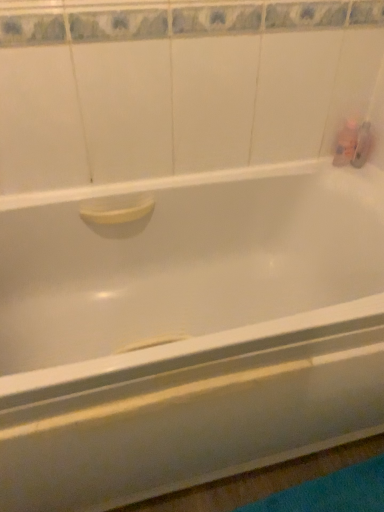
Question: From a real-world perspective, is translucent plastic bottle at upper right, the 1th toiletry viewed from the left, physically located above or below translucent plastic soap at upper right, which ranks as the second toiletry in left-to-right order?

Choices:
 (A) above
 (B) below

Answer: (A)

Question: Would you say translucent plastic bottle at upper right, which is the second toiletry in right-to-left order, is to the left or to the right of translucent plastic soap at upper right, which ranks as the second toiletry in left-to-right order, in the picture?

Choices:
 (A) left
 (B) right

Answer: (A)

Question: Based on their sizes in the image, would you say translucent plastic bottle at upper right, which is the second toiletry in right-to-left order, is bigger or smaller than translucent plastic soap at upper right, which is the 1th toiletry in right-to-left order?

Choices:
 (A) big
 (B) small

Answer: (A)

Question: Is point (370, 140) positioned closer to the camera than point (339, 151)?

Choices:
 (A) closer
 (B) farther

Answer: (A)

Question: Is translucent plastic soap at upper right, which is the 1th toiletry in right-to-left order, taller or shorter than translucent plastic bottle at upper right, which is the second toiletry in right-to-left order?

Choices:
 (A) tall
 (B) short

Answer: (B)

Question: From a real-world perspective, is translucent plastic soap at upper right, which is the 1th toiletry in right-to-left order, positioned above or below translucent plastic bottle at upper right, the 1th toiletry viewed from the left?

Choices:
 (A) below
 (B) above

Answer: (A)

Question: In the image, is translucent plastic soap at upper right, which is the 1th toiletry in right-to-left order, positioned in front of or behind translucent plastic bottle at upper right, which is the second toiletry in right-to-left order?

Choices:
 (A) behind
 (B) front

Answer: (A)